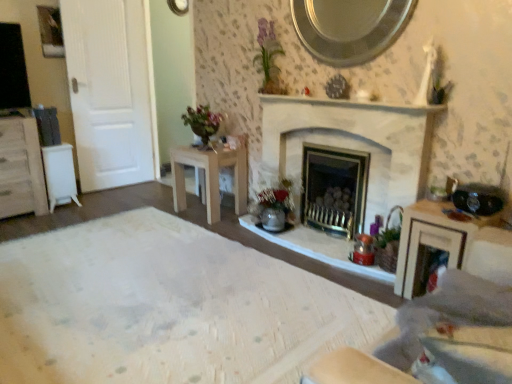
Question: From a real-world perspective, is white stone fireplace at center under white plastic table at left, the second table viewed from the right?

Choices:
 (A) no
 (B) yes

Answer: (A)

Question: From a real-world perspective, is white stone fireplace at center over white plastic table at left, which is the first table in left-to-right order?

Choices:
 (A) no
 (B) yes

Answer: (B)

Question: Does white stone fireplace at center have a larger size compared to white plastic table at left, which is the first table in left-to-right order?

Choices:
 (A) yes
 (B) no

Answer: (A)

Question: Does white stone fireplace at center have a lesser height compared to white plastic table at left, the second table viewed from the right?

Choices:
 (A) no
 (B) yes

Answer: (A)

Question: Can you confirm if white stone fireplace at center is smaller than white plastic table at left, which is the first table in left-to-right order?

Choices:
 (A) no
 (B) yes

Answer: (A)

Question: Is white plastic table at left, the second table viewed from the right, at the back of white stone fireplace at center?

Choices:
 (A) yes
 (B) no

Answer: (B)

Question: Are white stone fireplace at center and wooden vanity at right making contact?

Choices:
 (A) no
 (B) yes

Answer: (A)

Question: Is wooden vanity at right surrounded by white stone fireplace at center?

Choices:
 (A) no
 (B) yes

Answer: (A)

Question: Is white stone fireplace at center thinner than wooden vanity at right?

Choices:
 (A) no
 (B) yes

Answer: (B)

Question: Is white stone fireplace at center smaller than wooden vanity at right?

Choices:
 (A) no
 (B) yes

Answer: (A)

Question: Considering the relative positions of white stone fireplace at center and wooden vanity at right in the image provided, is white stone fireplace at center to the right of wooden vanity at right from the viewer's perspective?

Choices:
 (A) no
 (B) yes

Answer: (A)

Question: From the image's perspective, is white stone fireplace at center under wooden vanity at right?

Choices:
 (A) yes
 (B) no

Answer: (B)

Question: Does wooden vanity at right have a greater width compared to light wood table at center, the 1th table viewed from the right?

Choices:
 (A) yes
 (B) no

Answer: (B)